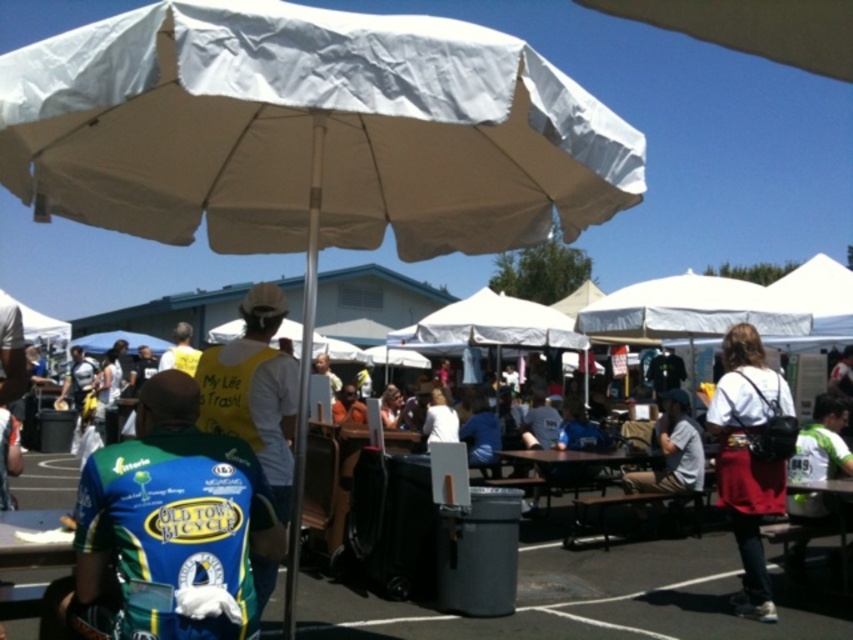
Is blue jersey at center positioned before white matte shirt at center?

That is True.

The image size is (853, 640). I want to click on blue jersey at center, so click(175, 522).

Who is more distant from viewer, (152,513) or (685,445)?

Positioned behind is point (685,445).

Does blue jersey at center have a smaller size compared to white cotton shirt at center?

Yes, blue jersey at center is smaller than white cotton shirt at center.

Who is more distant from viewer, (149,385) or (682,416)?

The point (682,416) is behind.

I want to click on blue jersey at center, so click(175, 522).

Who is lower down, white matte shirt at center or wooden picnic table at center?

wooden picnic table at center

This screenshot has width=853, height=640. I want to click on white matte shirt at center, so click(750, 456).

I want to click on white matte shirt at center, so click(750, 456).